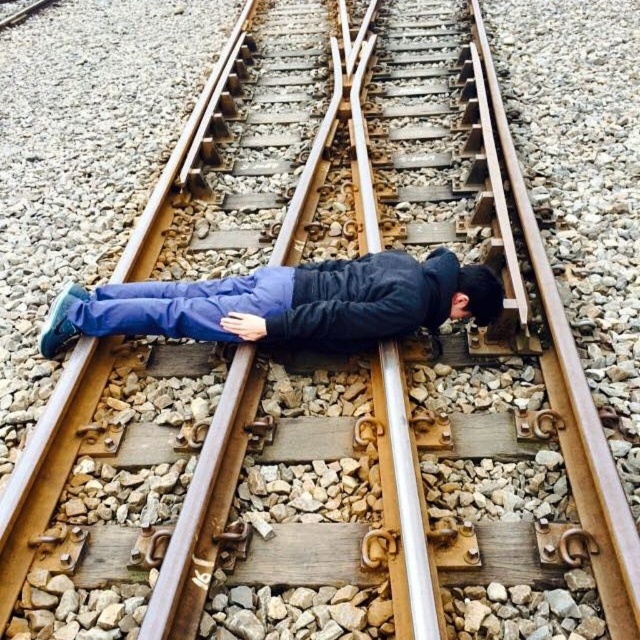
You are a railway worker inspecting the tracks and notice a person lying on the tracks. According to the scene, where is the blue fabric pants at center in relation to the black matte hair at center?

The blue fabric pants at center are to the left of the black matte hair at center.

You are a railway worker inspecting the tracks and notice the blue fabric pants at center and the black matte hair at center. Which object is nearer to you as you stand near the tracks?

The blue fabric pants at center is closer to the viewer than the black matte hair at center, so the blue fabric pants at center is nearer to you.

You are a railway worker inspecting the tracks and notice the blue fabric pants at center and the black matte hair at center. Which object is positioned higher in the image?

The blue fabric pants at center is much taller than the black matte hair at center, so the blue fabric pants at center is positioned higher in the image.